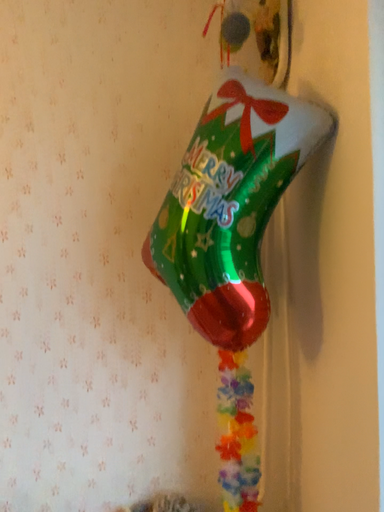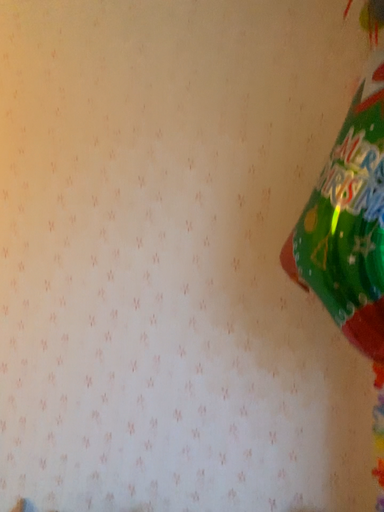
Question: How did the camera likely rotate when shooting the video?

Choices:
 (A) rotated left
 (B) rotated right

Answer: (A)